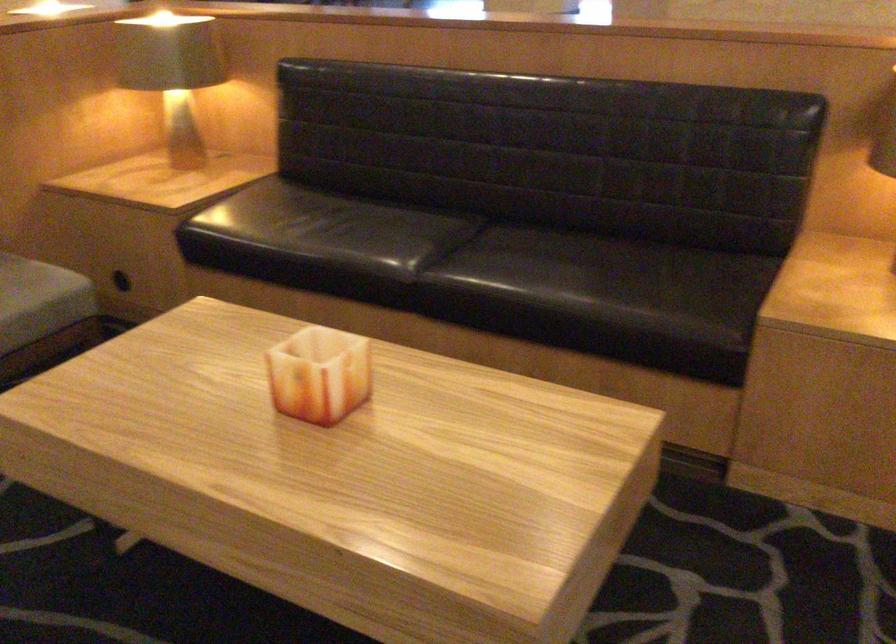
What do you see at coordinates (478, 267) in the screenshot?
I see `the black sofa sitting surface` at bounding box center [478, 267].